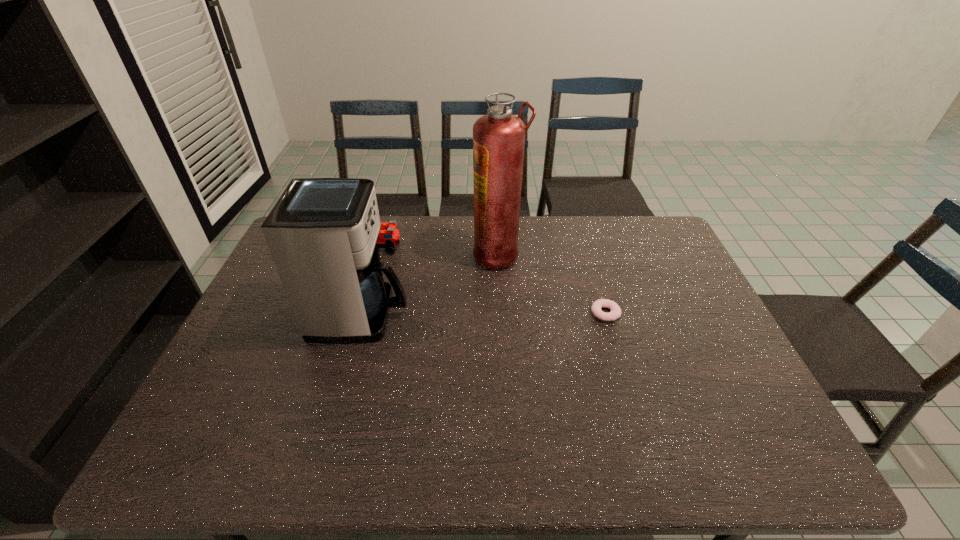
Locate an element on the screen. fire extinguisher is located at coordinates (498, 137).

In order to click on the tallest object in this screenshot , I will do `click(498, 137)`.

Where is `coffee maker`? The image size is (960, 540). coffee maker is located at coordinates (322, 233).

Find the location of a particular element. The image size is (960, 540). the second shortest object is located at coordinates (389, 236).

I want to click on the shortest object, so click(615, 313).

The height and width of the screenshot is (540, 960). I want to click on the rightmost object, so click(615, 313).

Where is `vacant space situated 0.320m on the side of the tallest object with the label`? vacant space situated 0.320m on the side of the tallest object with the label is located at coordinates (376, 255).

Where is `free space located on the side of the tallest object with the label`? Image resolution: width=960 pixels, height=540 pixels. free space located on the side of the tallest object with the label is located at coordinates (421, 255).

Locate an element on the screen. This screenshot has width=960, height=540. vacant space located 0.390m on the side of the tallest object with the label is located at coordinates pyautogui.click(x=355, y=255).

This screenshot has height=540, width=960. Identify the location of vacant space located 0.210m on the front panel of the third shortest object. (482, 315).